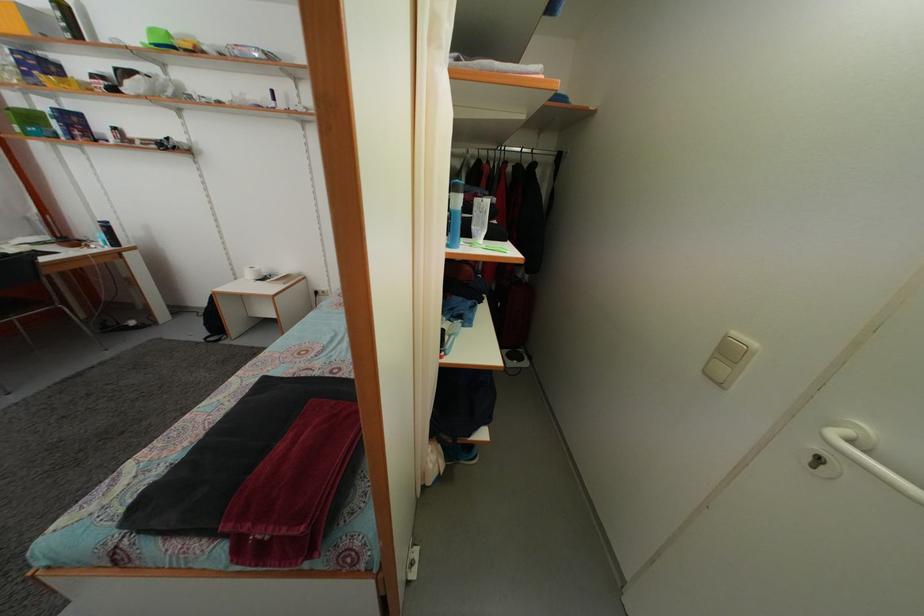
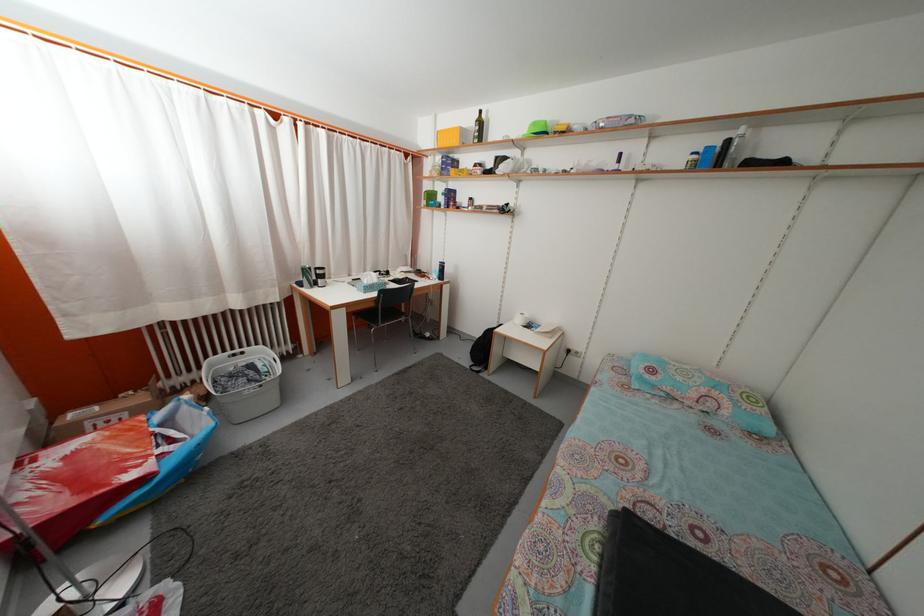
In the second image, find the point that corresponds to [210,310] in the first image.

(482, 342)